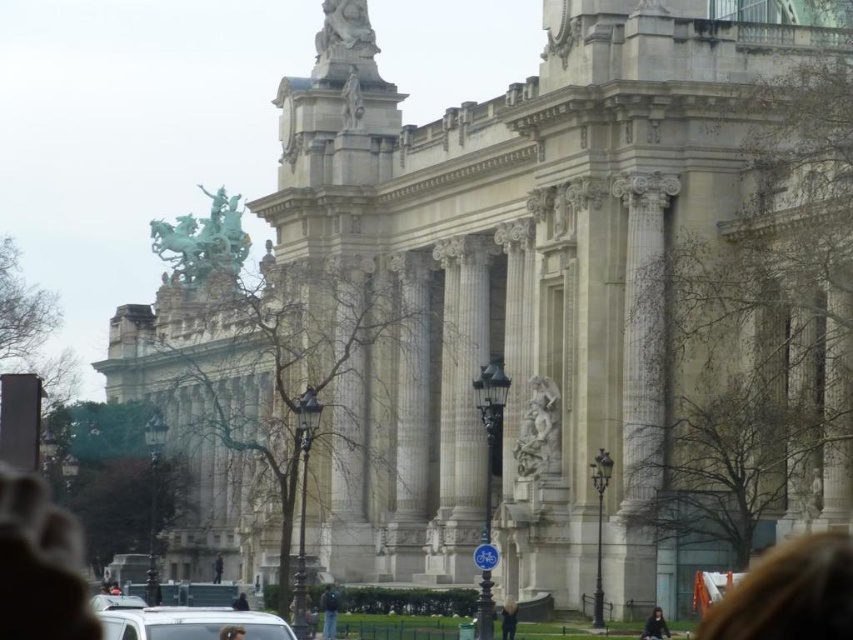
You are a delivery driver with a white matte van at lower center. You need to park your van next to the smooth green statue at center. Considering the statue is in a narrow alley, will your van fit without hitting the statue?

The white matte van at lower center is wider than the smooth green statue at center. Since the alley is narrow, the van may not fit without hitting the statue.

You are an architect designing a new pathway between the stone statue at upper center and the smooth green statue at center. Given that the statues are 32.28 meters apart, what is the minimum length of the pathway required to connect them?

The minimum length of the pathway required to connect the stone statue at upper center and the smooth green statue at center is 32.28 meters, as that is the direct distance between them.

You are a delivery driver who needs to park the white matte van at lower center in a space that requires vehicles to be shorter than the smooth green statue at center. Will the van fit?

The white matte van at lower center is much taller than the smooth green statue at center, so it will not fit in the parking space that requires vehicles to be shorter than the statue.